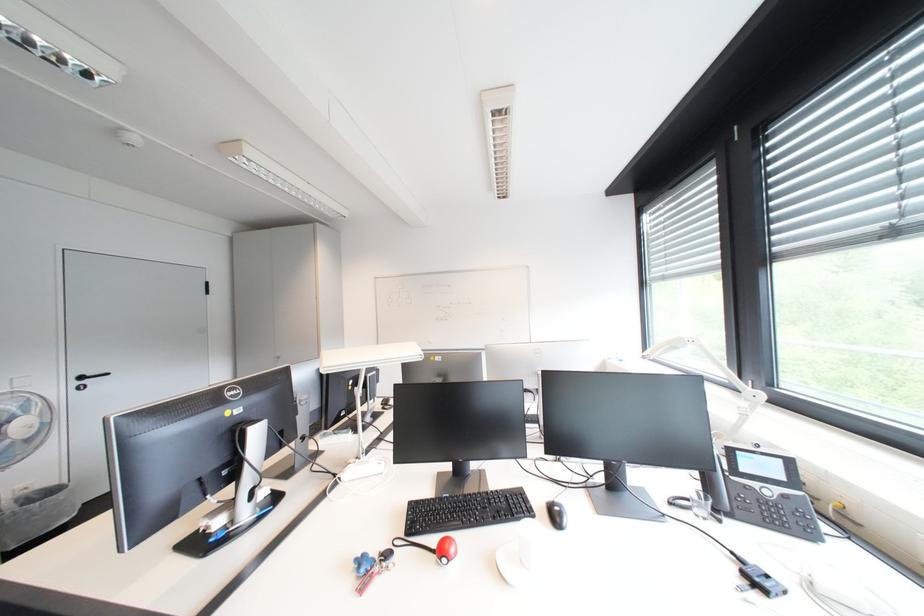
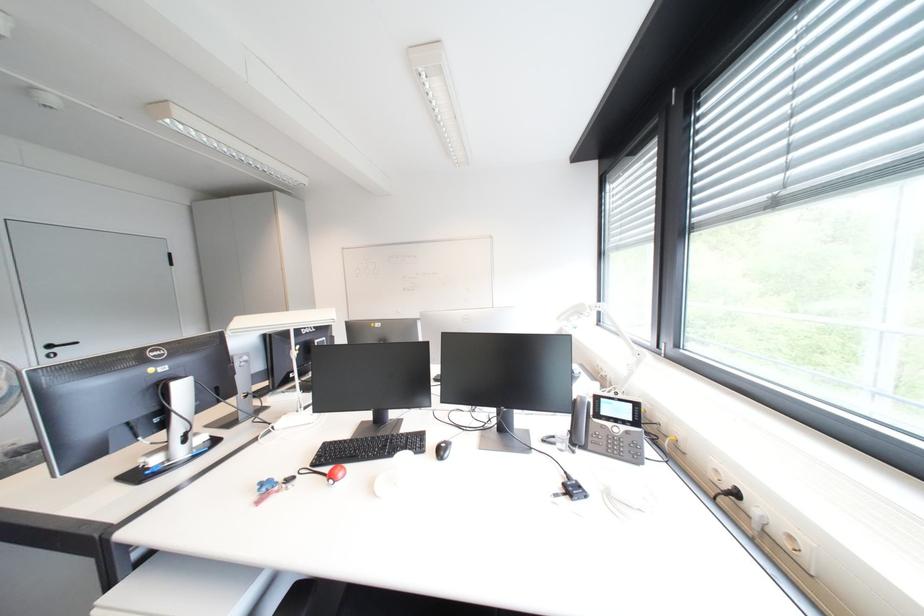
Question: The first image is from the beginning of the video and the second image is from the end. How did the camera likely rotate when shooting the video?

Choices:
 (A) Left
 (B) Right
 (C) Up
 (D) Down

Answer: (D)